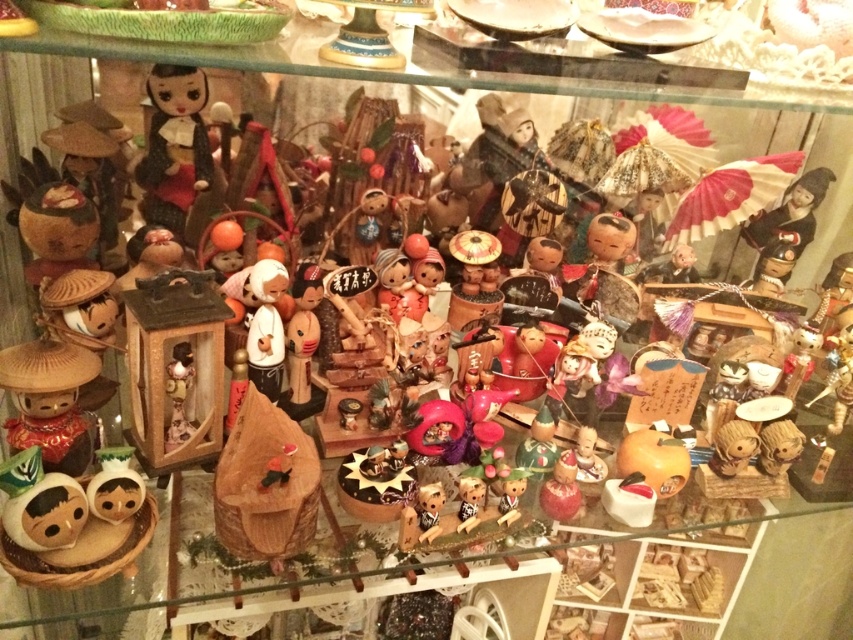
Question: Which of the following is the closest to the observer?

Choices:
 (A) shiny red lacquer bottle at center
 (B) matte brown figurine at left

Answer: (B)

Question: Can you confirm if matte brown figurine at left is positioned below shiny red lacquer bottle at center?

Choices:
 (A) yes
 (B) no

Answer: (B)

Question: Does matte brown figurine at left have a lesser width compared to shiny red lacquer bottle at center?

Choices:
 (A) yes
 (B) no

Answer: (B)

Question: Among these objects, which one is nearest to the camera?

Choices:
 (A) shiny red lacquer bottle at center
 (B) matte brown figurine at left

Answer: (B)

Question: Can you confirm if matte brown figurine at left is wider than shiny red lacquer bottle at center?

Choices:
 (A) no
 (B) yes

Answer: (B)